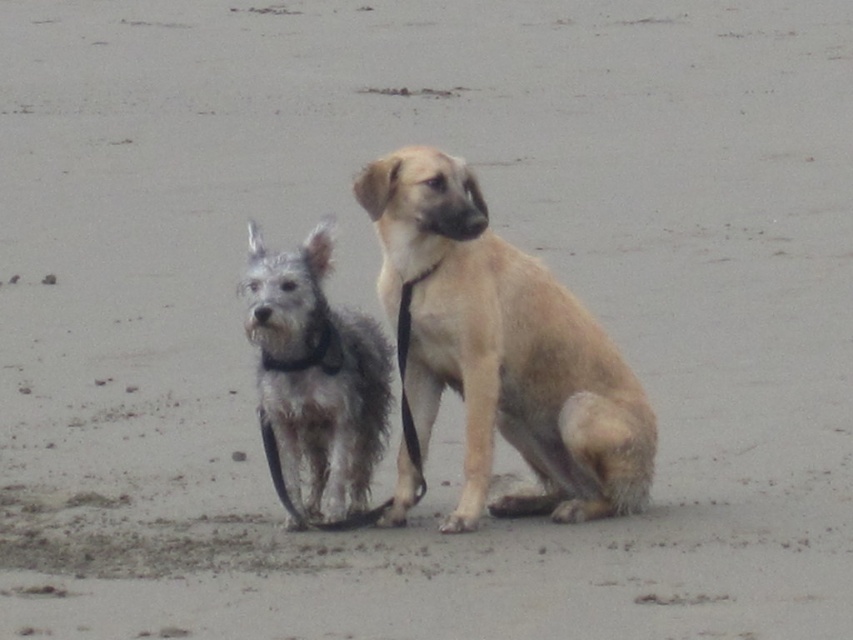
You are standing on the beach and want to place a 10 feet long wooden board between the two dogs. The board must be placed at the point with coordinates point (627, 376). Is the distance from you to that point sufficient to allow the board to fit without overlapping either dog?

The distance of point (627, 376) from viewer is 18.70 feet. Since the board is 10 feet long, the distance is sufficient as 18.70 feet is greater than 10 feet, so the board can be placed there without overlapping the dogs.

You are standing on the beach and see two points marked in the sand. The first point is at coordinates point (456, 525) and the second point is at point (318, 417). Which point is closer to you?

Point (456, 525) is closer to the viewer than point (318, 417).

You are a photographer trying to capture both dogs in a single frame. Since the light brown fur dog at center and the fuzzy gray dog at center are both at the center, which one is to the right of the other?

The light brown fur dog at center is positioned on the right side of fuzzy gray dog at center, so the light brown fur dog at center is to the right of the fuzzy gray dog at center.